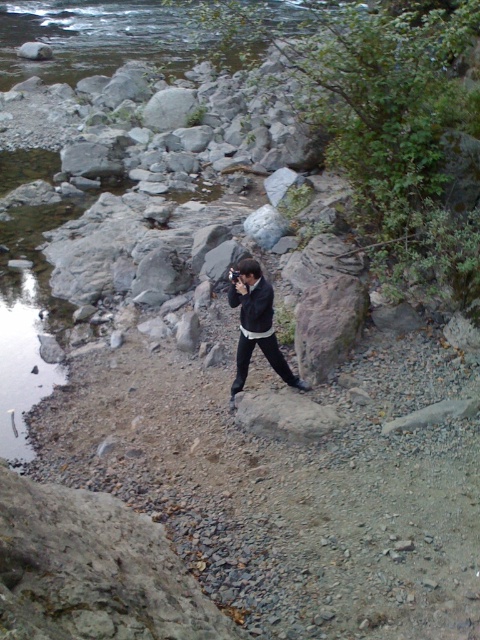
Looking at this image, is gray rough rock at center thinner than matte black jacket at center?

No.

Is point (348, 275) closer to viewer compared to point (240, 321)?

No.

Is point (298, 307) less distant than point (244, 269)?

No, (298, 307) is behind (244, 269).

Where is `gray rough rock at center`? The height and width of the screenshot is (640, 480). gray rough rock at center is located at coordinates (327, 324).